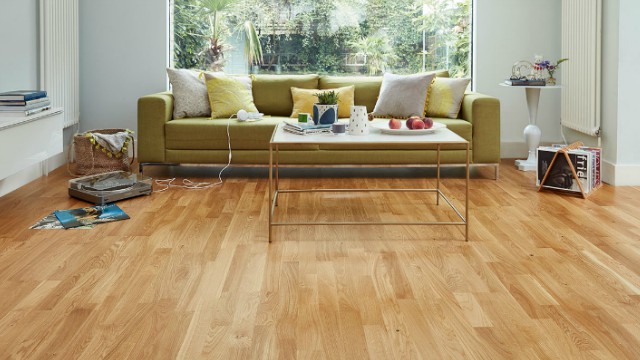
I want to click on table to the right of couch, so [539, 93].